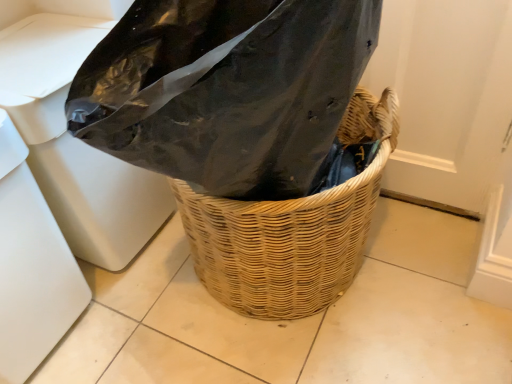
Where is `free space to the right of woven wood basket at center`? This screenshot has width=512, height=384. free space to the right of woven wood basket at center is located at coordinates (424, 276).